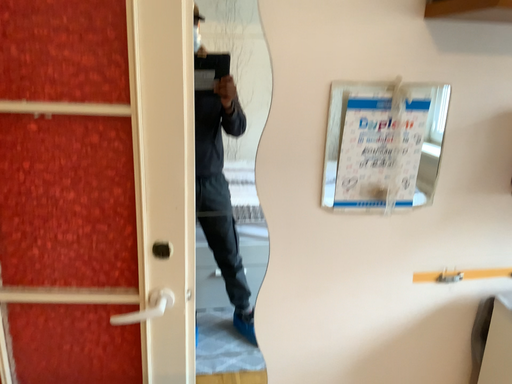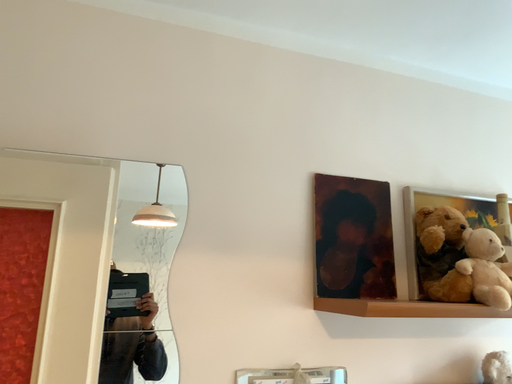
Question: Which way did the camera rotate in the video?

Choices:
 (A) rotated downward
 (B) rotated upward

Answer: (B)